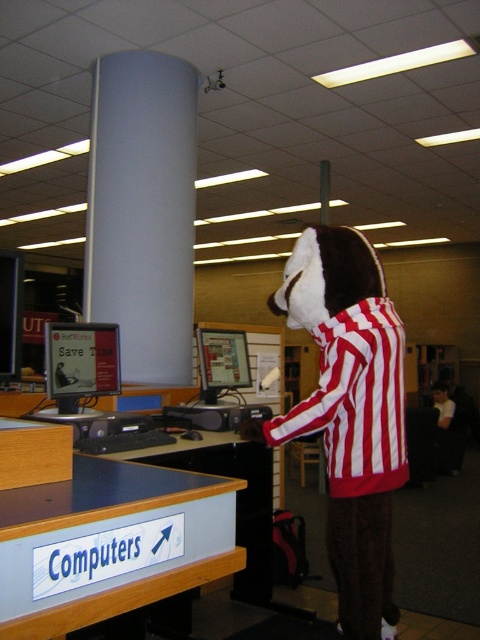
Question: Which object is closer to the camera taking this photo?

Choices:
 (A) red and white striped plush at center
 (B) blue laminate sign at lower left

Answer: (B)

Question: Which point is closer to the camera?

Choices:
 (A) blue laminate sign at lower left
 (B) matte black monitor at center
 (C) red and white striped plush at center

Answer: (A)

Question: Is blue laminate sign at lower left in front of white smooth pillar at center?

Choices:
 (A) no
 (B) yes

Answer: (B)

Question: Is red and white striped plush at center bigger than blue laminate sign at lower left?

Choices:
 (A) no
 (B) yes

Answer: (B)

Question: Where is blue laminate sign at lower left located in relation to matte black monitor at center in the image?

Choices:
 (A) below
 (B) above

Answer: (A)

Question: Which object is positioned closest to the white smooth pillar at center?

Choices:
 (A) matte black monitor at center
 (B) blue laminate sign at lower left

Answer: (A)